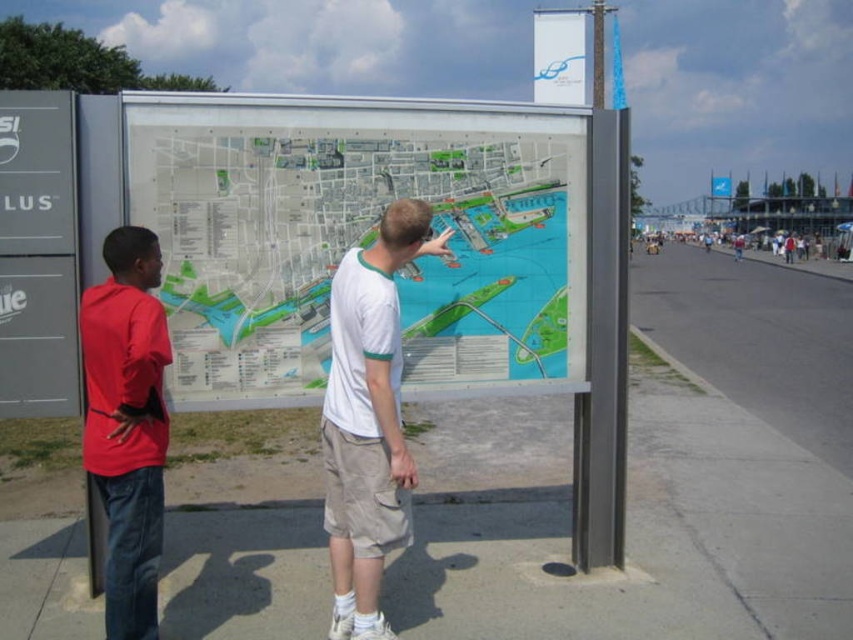
Can you confirm if red cotton shirt at left is wider than white plastic banner at upper center?

No, red cotton shirt at left is not wider than white plastic banner at upper center.

This screenshot has height=640, width=853. What do you see at coordinates (126, 422) in the screenshot?
I see `red cotton shirt at left` at bounding box center [126, 422].

Find the location of `red cotton shirt at left`. red cotton shirt at left is located at coordinates (126, 422).

Between transparent plastic map at center and metallic gray sign at left, which one appears on the right side from the viewer's perspective?

transparent plastic map at center is more to the right.

Between point (228, 228) and point (18, 413), which one is positioned in front?

Point (18, 413) is in front.

Find the location of a particular element. This screenshot has width=853, height=640. transparent plastic map at center is located at coordinates (368, 228).

Between metallic gray sign at left and white plastic banner at upper center, which one is positioned higher?

white plastic banner at upper center

Does metallic gray sign at left appear over white plastic banner at upper center?

No, metallic gray sign at left is not above white plastic banner at upper center.

Identify the location of metallic gray sign at left. (38, 253).